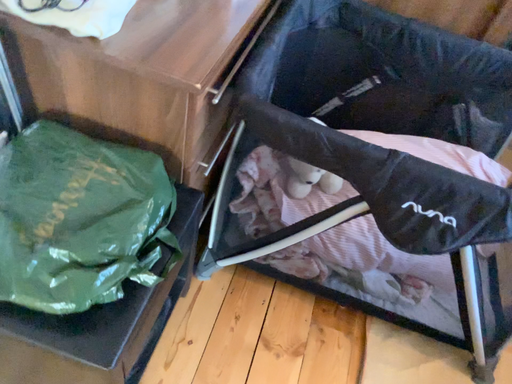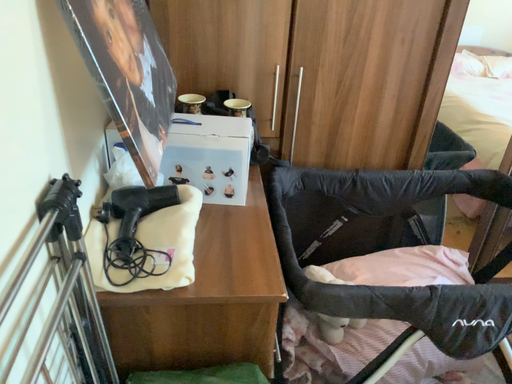
Question: Which way did the camera rotate in the video?

Choices:
 (A) rotated left
 (B) rotated right

Answer: (B)